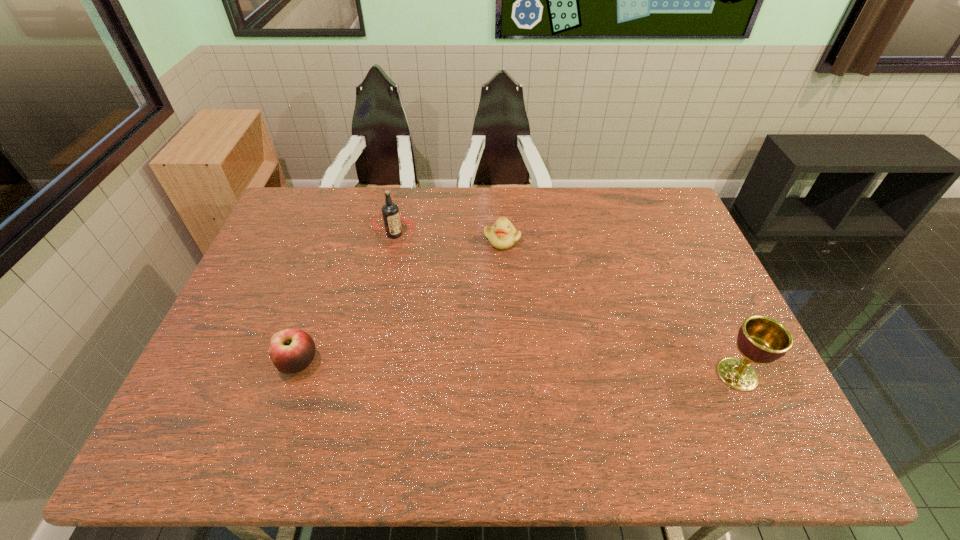
Identify the location of free spot on the desktop that is between the leftmost object and the chalice and is positioned on the beak of the duckling. (564, 370).

Find the location of a particular element. vacant space on the desktop that is between the apple and the rightmost object and is positioned on the label of the root beer is located at coordinates (452, 367).